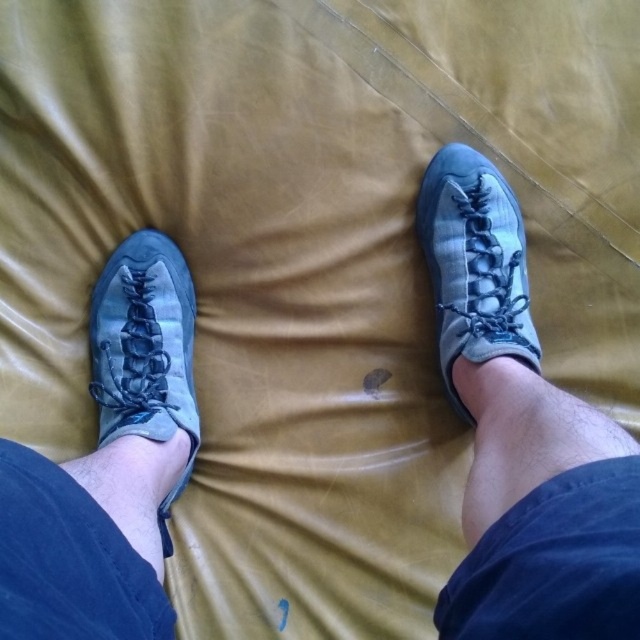
Question: Which object is farther from the camera taking this photo?

Choices:
 (A) matte gray shoe at left
 (B) matte blue fabric shoe at right

Answer: (B)

Question: Does matte blue fabric shoe at right have a greater width compared to matte gray shoe at left?

Choices:
 (A) no
 (B) yes

Answer: (A)

Question: Is matte blue fabric shoe at right to the left of matte gray shoe at left from the viewer's perspective?

Choices:
 (A) no
 (B) yes

Answer: (A)

Question: Which of the following is the farthest from the observer?

Choices:
 (A) matte blue fabric shoe at right
 (B) matte gray shoe at left

Answer: (A)

Question: Does matte blue fabric shoe at right have a lesser width compared to matte gray shoe at left?

Choices:
 (A) no
 (B) yes

Answer: (B)

Question: Which of the following is the closest to the observer?

Choices:
 (A) (100, 291)
 (B) (518, 225)

Answer: (A)